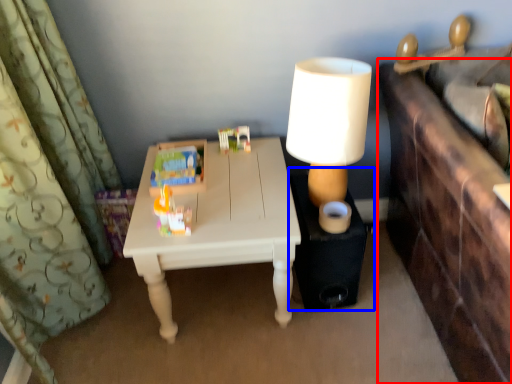
Question: Which object appears farthest to the camera in this image, vanity (highlighted by a red box) or side table (highlighted by a blue box)?

Choices:
 (A) vanity
 (B) side table

Answer: (B)